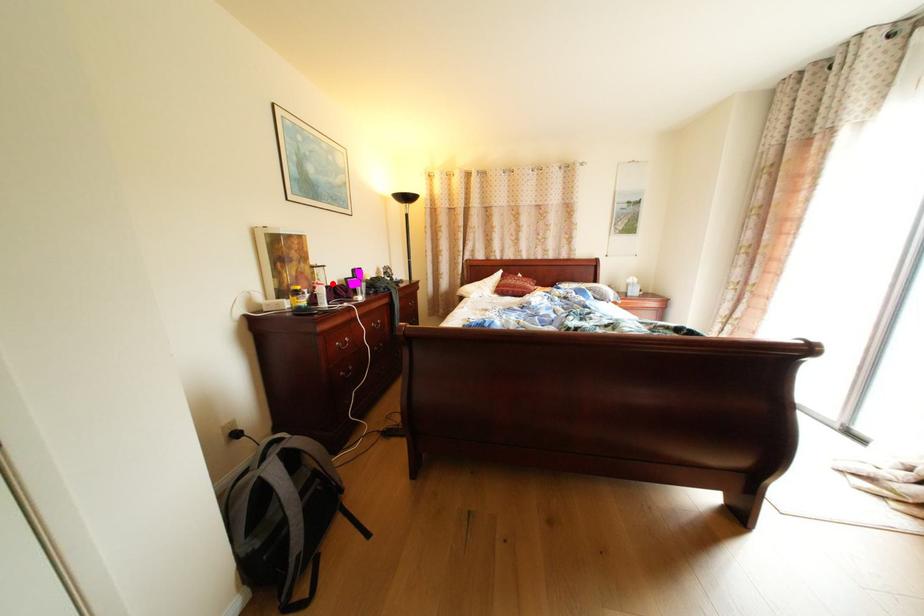
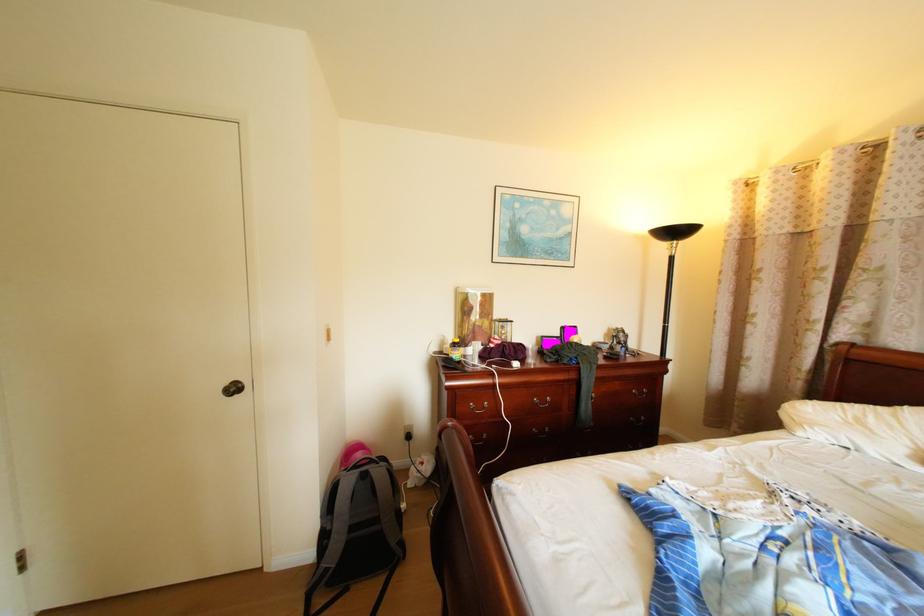
In the second image, find the point that corresponds to the highlighted location in the first image.

(509, 339)